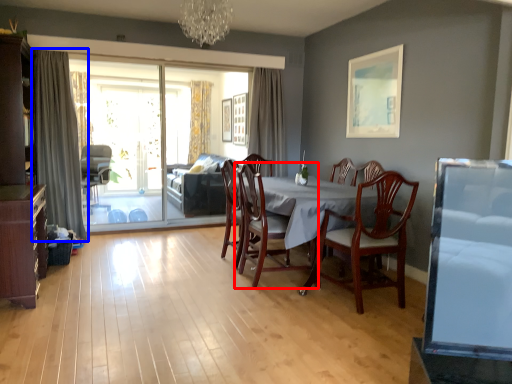
Question: Which point is further to the camera, chair (highlighted by a red box) or curtain (highlighted by a blue box)?

Choices:
 (A) chair
 (B) curtain

Answer: (B)